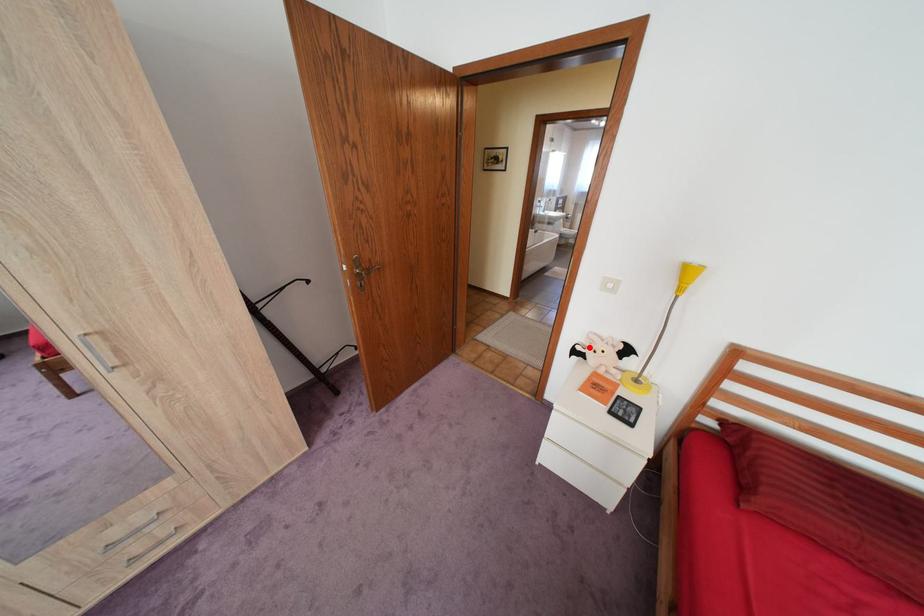
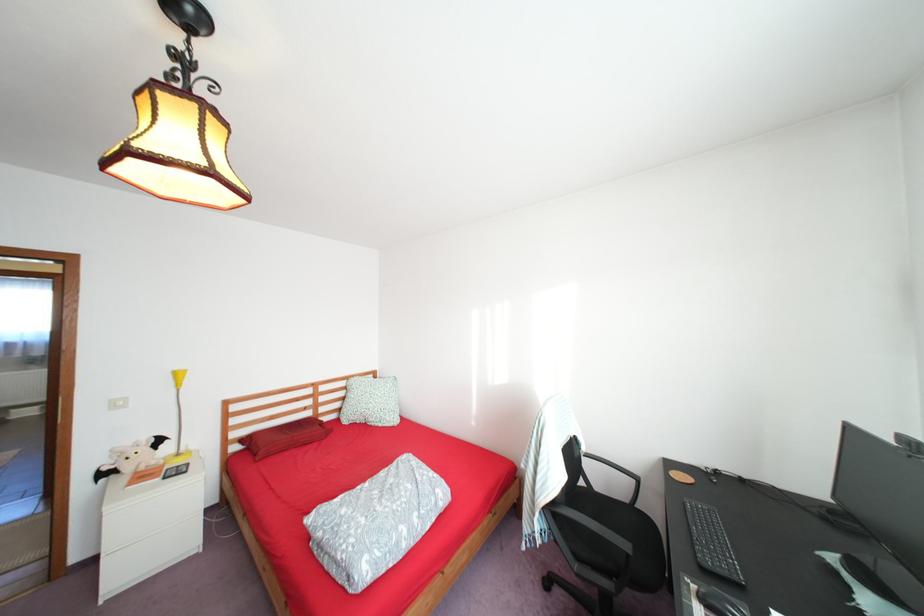
Locate, in the second image, the point that corresponds to the highlighted location in the first image.

(116, 468)